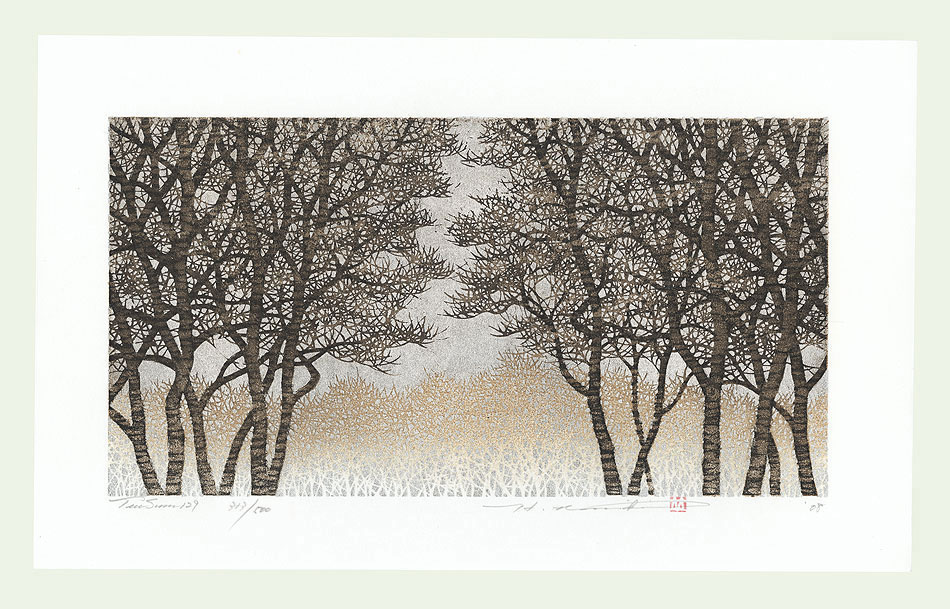
Find the location of `greenish-grey secondary mounting to frame the artwork`. greenish-grey secondary mounting to frame the artwork is located at coordinates (668, 13).